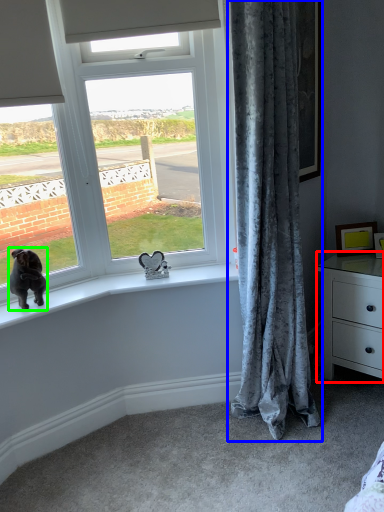
Question: Which object is the closest to the chest of drawers (highlighted by a red box)? Choose among these: curtain (highlighted by a blue box) or dog (highlighted by a green box).

Choices:
 (A) curtain
 (B) dog

Answer: (A)